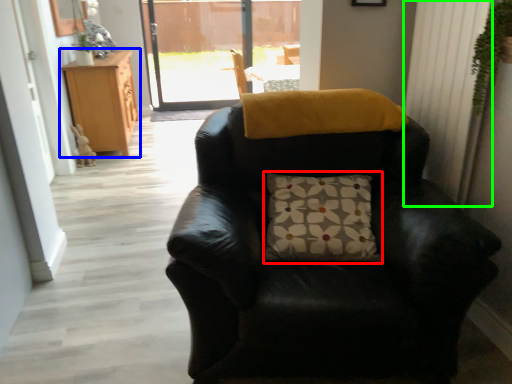
Question: Which object is positioned closest to pillow (highlighted by a red box)? Select from cabinetry (highlighted by a blue box) and curtain (highlighted by a green box).

Choices:
 (A) cabinetry
 (B) curtain

Answer: (B)